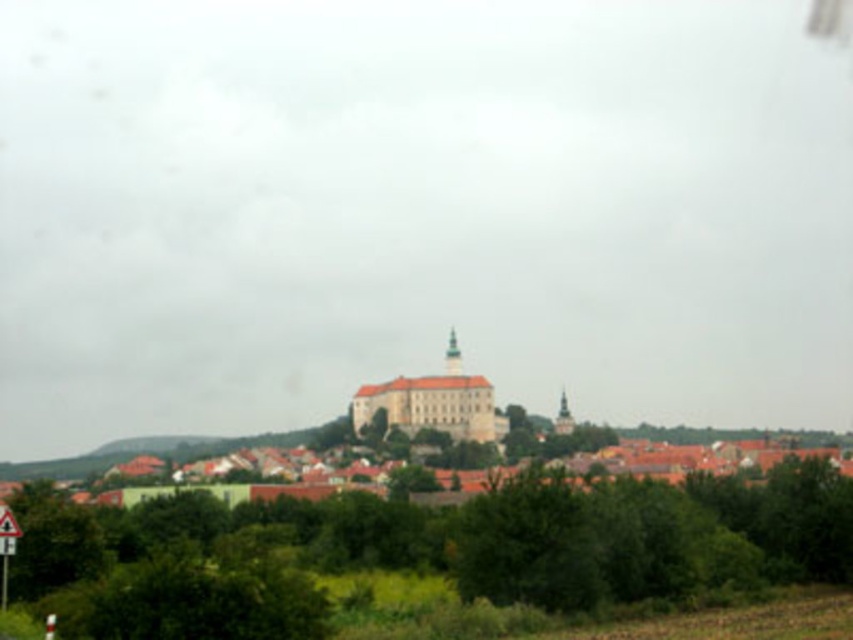
Does white stone town at center appear on the left side of white plastic triangle at lower left?

No, white stone town at center is not to the left of white plastic triangle at lower left.

In order to click on white stone town at center in this screenshot , I will do `click(432, 401)`.

This screenshot has width=853, height=640. Describe the element at coordinates (432, 401) in the screenshot. I see `white stone town at center` at that location.

Locate an element on the screen. Image resolution: width=853 pixels, height=640 pixels. white stone town at center is located at coordinates (432, 401).